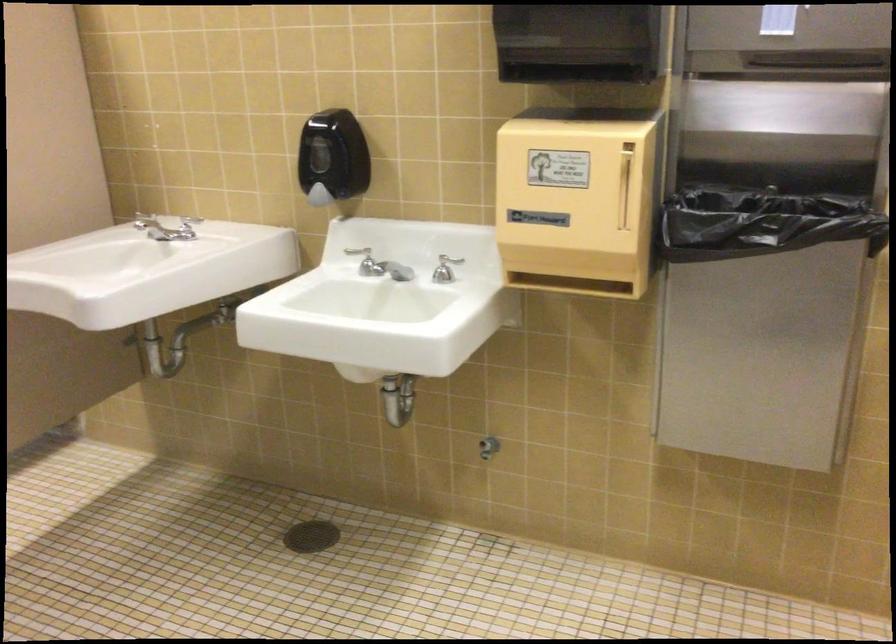
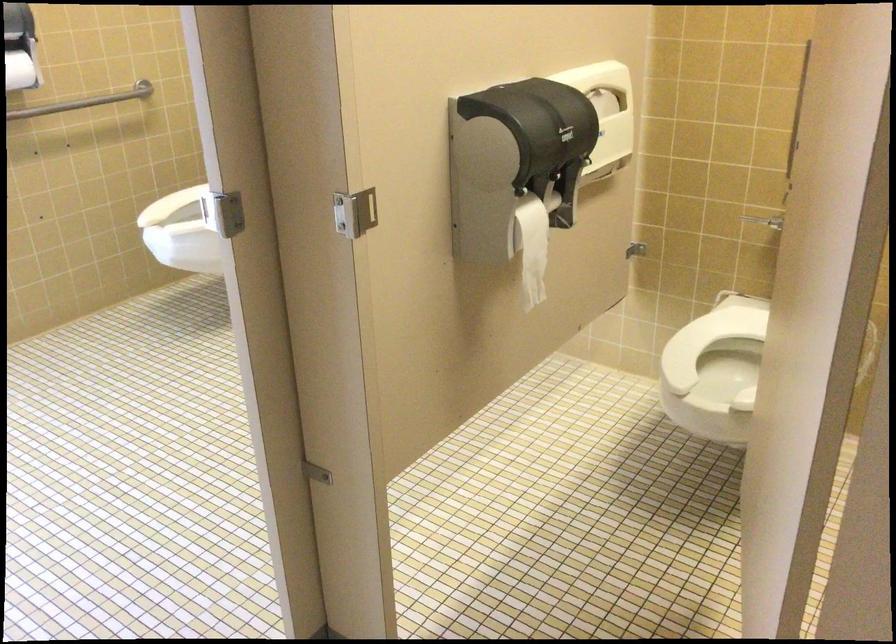
Question: Which direction would the cameraman need to move to produce the second image? Reply with the corresponding letter.

Choices:
 (A) Left
 (B) Right
 (C) Forward
 (D) Backward

Answer: (A)